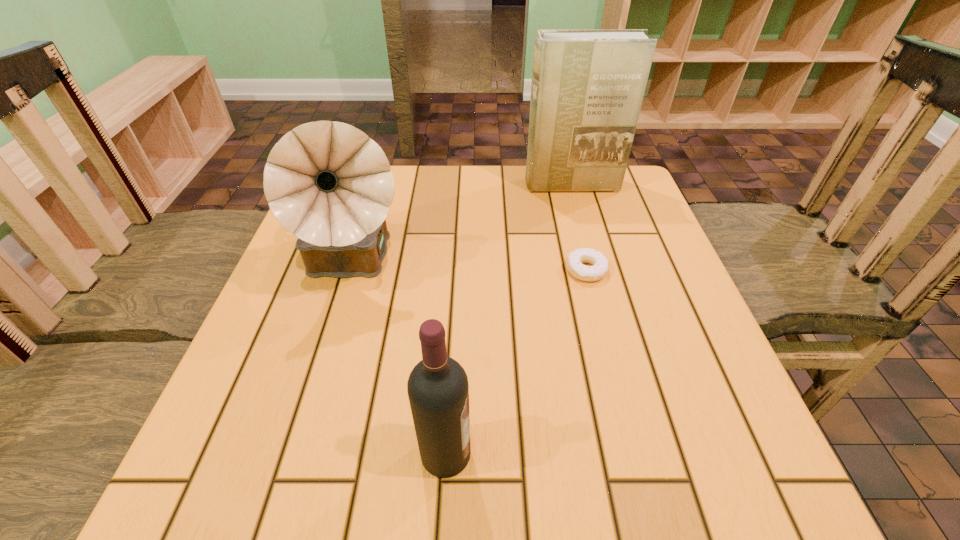
Image resolution: width=960 pixels, height=540 pixels. Identify the location of free space between the shortest object and the record player. (469, 268).

Find the location of `empty space between the second object from left to right and the record player`. empty space between the second object from left to right and the record player is located at coordinates (399, 360).

Where is `empty space between the phonebook and the doughnut`? The width and height of the screenshot is (960, 540). empty space between the phonebook and the doughnut is located at coordinates (579, 227).

Identify the location of vacant space in between the wine bottle and the doughnut. (516, 362).

At what (x,y) coordinates should I click in order to perform the action: click on vacant region between the third tallest object and the phonebook. Please return your answer as a coordinate pair (x, y). This screenshot has width=960, height=540. Looking at the image, I should click on (508, 319).

The width and height of the screenshot is (960, 540). I want to click on vacant area that lies between the phonebook and the third tallest object, so click(x=508, y=319).

You are a GUI agent. You are given a task and a screenshot of the screen. Output one action in this format:
    pyautogui.click(x=<x>, y=<y>)
    Task: Click on the vacant point located between the leftmost object and the farthest object
    
    Given the screenshot: What is the action you would take?
    pyautogui.click(x=462, y=226)

The width and height of the screenshot is (960, 540). Identify the location of free spot between the third tallest object and the phonebook. (508, 319).

You are a GUI agent. You are given a task and a screenshot of the screen. Output one action in this format:
    pyautogui.click(x=<x>, y=<y>)
    Task: Click on the free space between the shortest object and the leftmost object
    
    Given the screenshot: What is the action you would take?
    pyautogui.click(x=469, y=268)

Find the location of `empty space that is in between the farthest object and the doughnut`. empty space that is in between the farthest object and the doughnut is located at coordinates (579, 227).